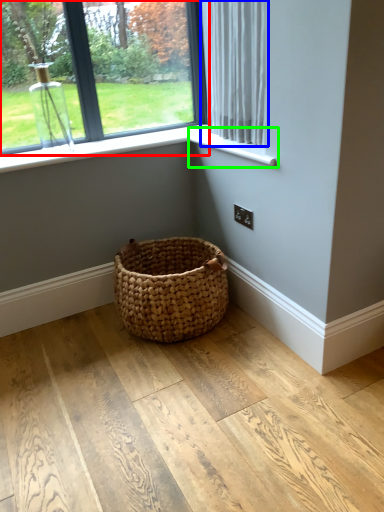
Question: Considering the real-world distances, which object is closest to window (highlighted by a red box)? curtain (highlighted by a blue box) or window sill (highlighted by a green box).

Choices:
 (A) curtain
 (B) window sill

Answer: (A)